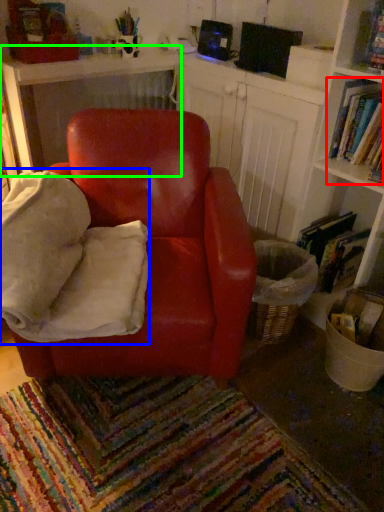
Question: Estimate the real-world distances between objects in this image. Which object is farther from book (highlighted by a red box), bean bag chair (highlighted by a blue box) or table (highlighted by a green box)?

Choices:
 (A) bean bag chair
 (B) table

Answer: (B)